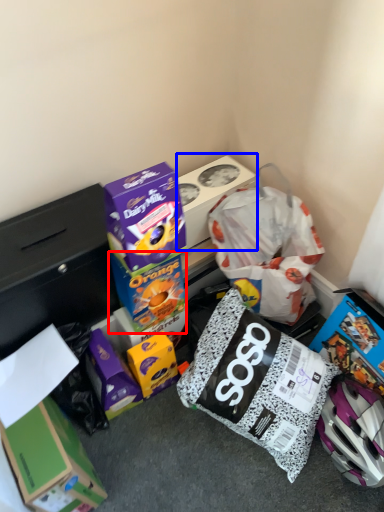
Question: Which of the following is the closest to the observer, box (highlighted by a red box) or box (highlighted by a blue box)?

Choices:
 (A) box
 (B) box

Answer: (A)